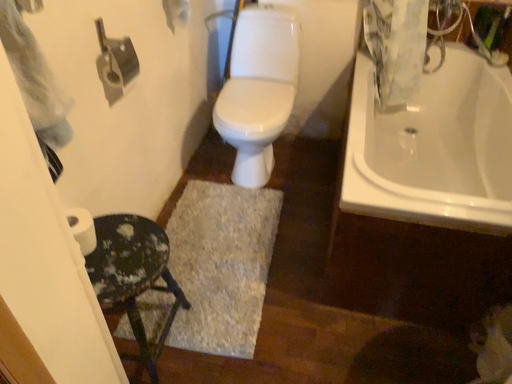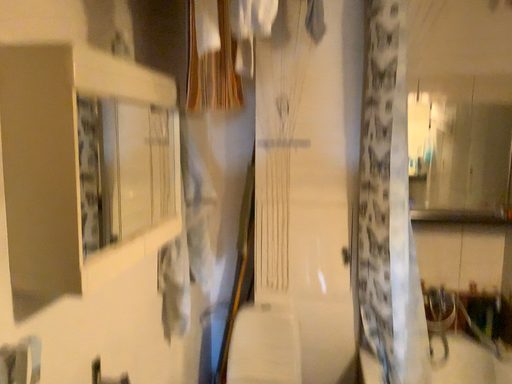
Question: How did the camera likely rotate when shooting the video?

Choices:
 (A) rotated upward
 (B) rotated downward

Answer: (A)